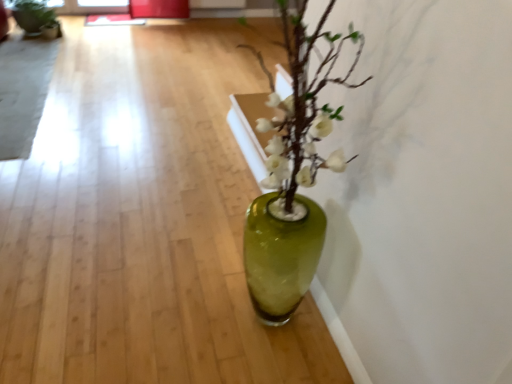
Question: Should I look upward or downward to see green glass vase at center?

Choices:
 (A) up
 (B) down

Answer: (B)

Question: Is matte black pot at upper left positioned far away from translucent glass vase at center?

Choices:
 (A) no
 (B) yes

Answer: (B)

Question: Is matte black pot at upper left taller than translucent glass vase at center?

Choices:
 (A) yes
 (B) no

Answer: (A)

Question: Does matte black pot at upper left appear on the left side of translucent glass vase at center?

Choices:
 (A) yes
 (B) no

Answer: (A)

Question: From the image's perspective, is matte black pot at upper left above translucent glass vase at center?

Choices:
 (A) yes
 (B) no

Answer: (A)

Question: Is matte black pot at upper left smaller than translucent glass vase at center?

Choices:
 (A) no
 (B) yes

Answer: (B)

Question: Can you confirm if matte black pot at upper left is thinner than translucent glass vase at center?

Choices:
 (A) yes
 (B) no

Answer: (B)

Question: From the image's perspective, would you say translucent glass vase at center is shown under green glass vase at center?

Choices:
 (A) no
 (B) yes

Answer: (A)

Question: From a real-world perspective, does translucent glass vase at center sit lower than green glass vase at center?

Choices:
 (A) no
 (B) yes

Answer: (A)

Question: Considering the relative sizes of translucent glass vase at center and green glass vase at center in the image provided, is translucent glass vase at center bigger than green glass vase at center?

Choices:
 (A) yes
 (B) no

Answer: (A)

Question: From a real-world perspective, is translucent glass vase at center on green glass vase at center?

Choices:
 (A) no
 (B) yes

Answer: (B)

Question: Could you tell me if translucent glass vase at center is turned towards green glass vase at center?

Choices:
 (A) yes
 (B) no

Answer: (A)

Question: Can you confirm if translucent glass vase at center is thinner than green glass vase at center?

Choices:
 (A) no
 (B) yes

Answer: (A)

Question: Does green glass vase at center have a greater width compared to matte black pot at upper left?

Choices:
 (A) no
 (B) yes

Answer: (A)